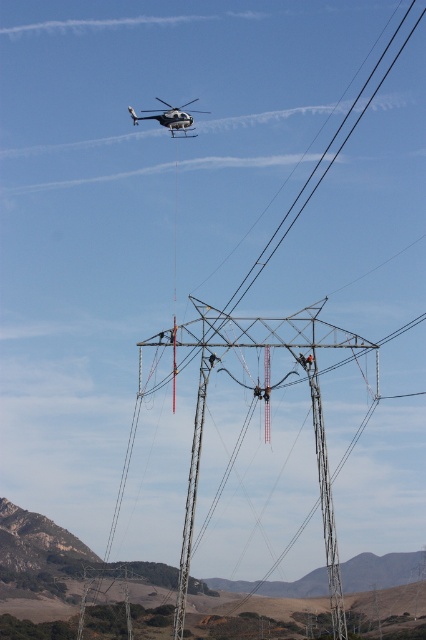
You are a worker on the ground looking at the metallic silver tower at center and the white glossy helicopter at upper center. Which object is positioned to the left of the other?

The metallic silver tower at center is to the right of the white glossy helicopter at upper center, so the white glossy helicopter at upper center is positioned to the left of the metallic silver tower at center.

You are a technician standing at the base of the transmission tower. You need to reach a specific point marked at coordinates point (264, 333). The helicopter can lower a technician to a point no farther than 250 meters from the camera. Can the helicopter safely lower you to the point?

The point (264, 333) is 235.28 meters away from the camera, which is within the helicopter winch system maximum 250 meters range. The helicopter can safely lower you to the point.

You are a technician standing at the point labeled point (x=311, y=412). You need to reach the metallic silver tower at center. Which direction should you move to reach it?

The metallic silver tower at center is represented by point (x=311, y=412), so you are already at the location of the metallic silver tower at center.